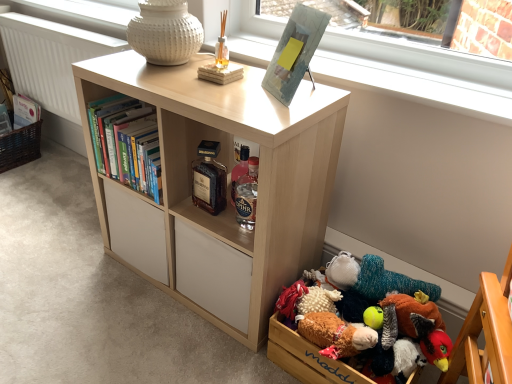
Question: Is hardcover books at left in front of or behind brown glass bottle at center, which is counted as the 2th bottle, starting from the right, in the image?

Choices:
 (A) front
 (B) behind

Answer: (B)

Question: Considering the positions of hardcover books at left and brown glass bottle at center, which ranks as the 1th bottle in left-to-right order, in the image, is hardcover books at left bigger or smaller than brown glass bottle at center, which ranks as the 1th bottle in left-to-right order,?

Choices:
 (A) big
 (B) small

Answer: (A)

Question: Which of these objects is positioned farthest from the light wood bookcase at center?

Choices:
 (A) brown glass bottle at center, which ranks as the 1th bottle in left-to-right order
 (B) fluffy multicolored stuffed animal at lower right, which is the second toy from back to front
 (C) translucent glass bottle at center, which ranks as the second bottle in left-to-right order
 (D) white textured radiator at lower left
 (E) hardcover books at left

Answer: (D)

Question: Which of these objects is positioned closest to the translucent glass bottle at center, the first bottle from the right?

Choices:
 (A) hardcover books at left
 (B) brown glass bottle at center, which ranks as the 1th bottle in left-to-right order
 (C) fluffy multicolored stuffed animal at lower right, which is counted as the 2th toy, starting from the front
 (D) wooden plush toys at lower right
 (E) knitted plush toy at lower right, the 1th toy viewed from the back

Answer: (B)